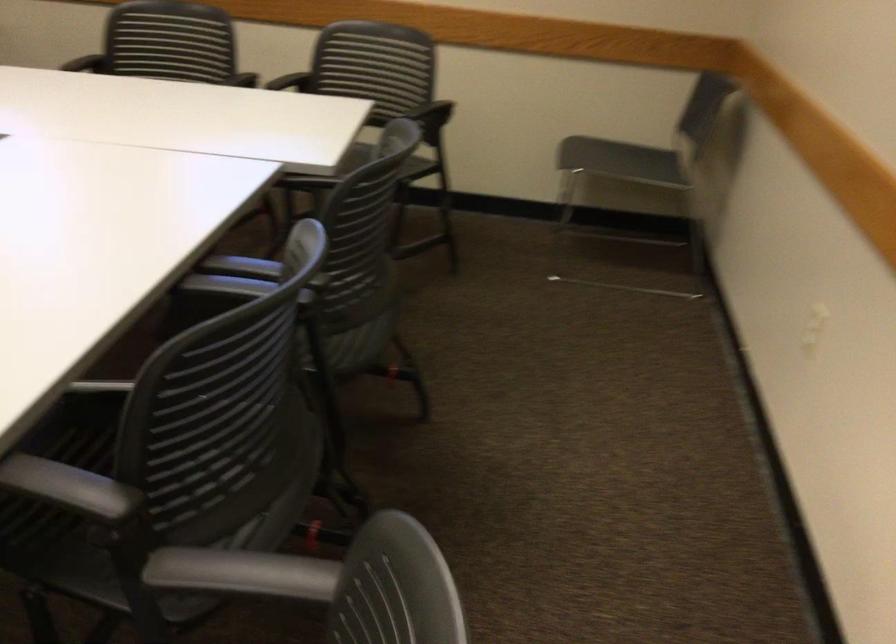
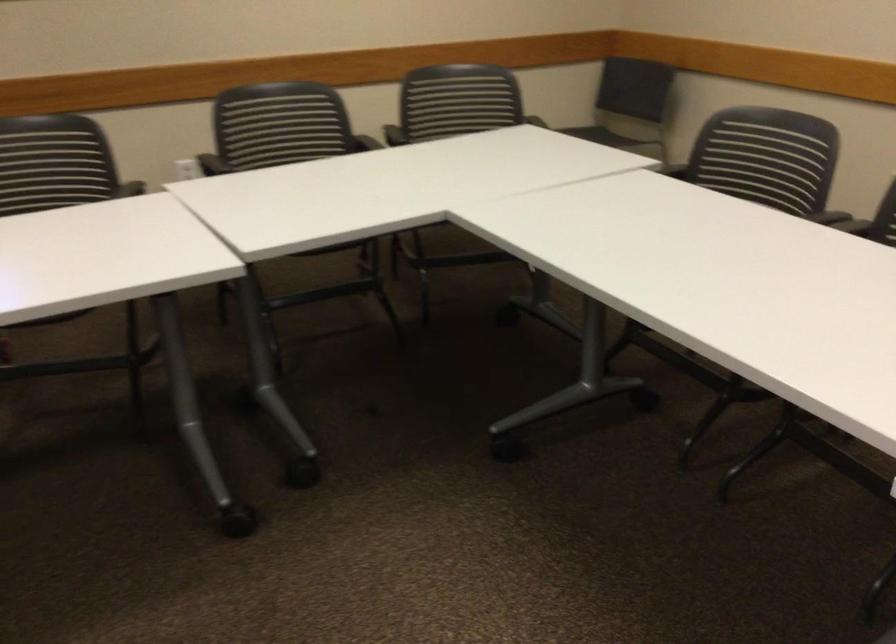
Where in the second image is the point corresponding to pixel 712 219 from the first image?

(660, 158)